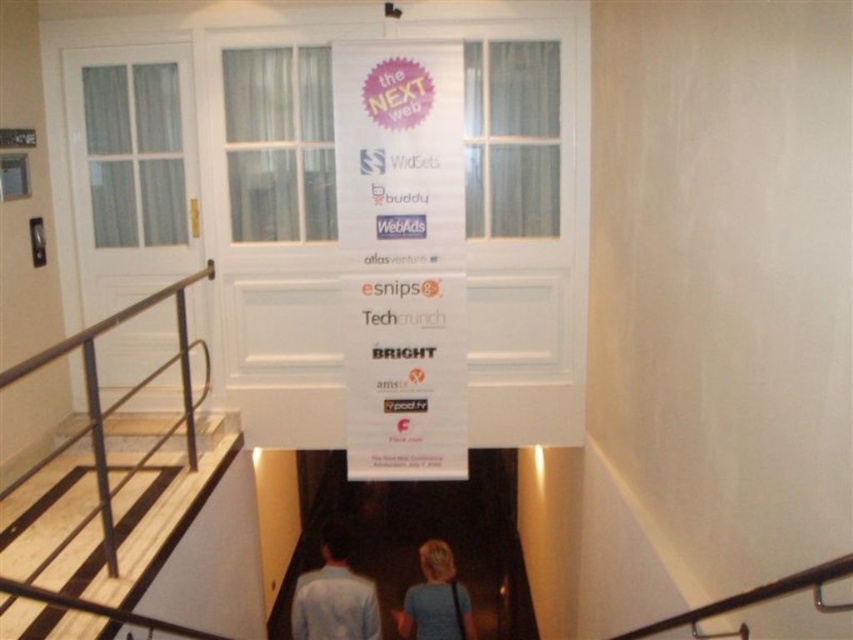
Can you confirm if white paper banner at center is shorter than wooden stairs at lower left?

No, white paper banner at center is not shorter than wooden stairs at lower left.

Image resolution: width=853 pixels, height=640 pixels. I want to click on white paper banner at center, so click(401, 257).

In the scene shown: Is wooden stairs at lower left positioned in front of blonde hair at lower center?

Yes.

In the scene shown: Can you confirm if wooden stairs at lower left is taller than blonde hair at lower center?

Indeed, wooden stairs at lower left has a greater height compared to blonde hair at lower center.

You are a GUI agent. You are given a task and a screenshot of the screen. Output one action in this format:
    pyautogui.click(x=<x>, y=<y>)
    Task: Click on the wooden stairs at lower left
    Image resolution: width=853 pixels, height=640 pixels.
    Given the screenshot: What is the action you would take?
    pyautogui.click(x=144, y=518)

Between point (299, 577) and point (451, 634), which one is positioned behind?

The point (299, 577) is more distant.

Which is behind, point (358, 624) or point (410, 632)?

The point (410, 632) is more distant.

The image size is (853, 640). Find the location of `light blue shirt at center`. light blue shirt at center is located at coordinates (334, 596).